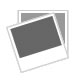
Locate an element on the screen. This screenshot has width=80, height=80. box is located at coordinates (27, 38), (45, 56), (63, 19).